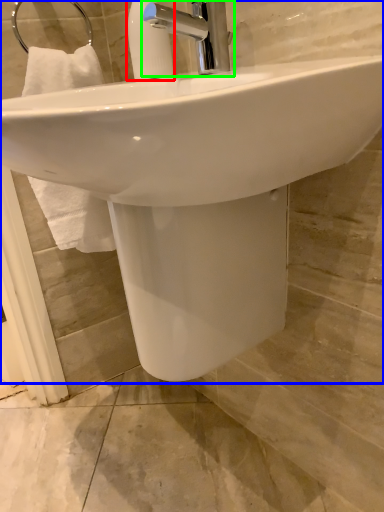
Question: Which object is positioned closest to soap dispenser (highlighted by a red box)? Select from sink (highlighted by a blue box) and tap (highlighted by a green box).

Choices:
 (A) sink
 (B) tap

Answer: (B)